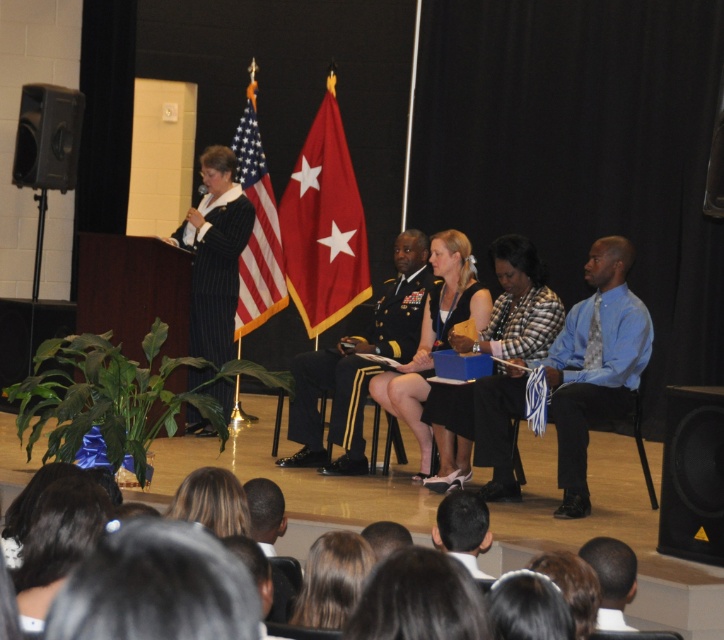
Question: Among these objects, which one is nearest to the camera?

Choices:
 (A) black fabric dress at center
 (B) black pinstripe suit at left

Answer: (A)

Question: Does black fabric dress at center appear under smooth brown hair at lower center?

Choices:
 (A) no
 (B) yes

Answer: (A)

Question: Does black pinstripe suit at left have a larger size compared to matte black dress at center?

Choices:
 (A) yes
 (B) no

Answer: (B)

Question: Which of the following is the farthest from the observer?

Choices:
 (A) (560, 316)
 (B) (392, 301)
 (C) (56, 86)
 (D) (602, 586)

Answer: (C)

Question: Among these objects, which one is farthest from the camera?

Choices:
 (A) blue shirt at right
 (B) blonde hair at lower center
 (C) black matte speaker at lower right
 (D) red fabric flag at center

Answer: (D)

Question: Is matte black dress at center closer to camera compared to smooth black hair at lower center?

Choices:
 (A) yes
 (B) no

Answer: (B)